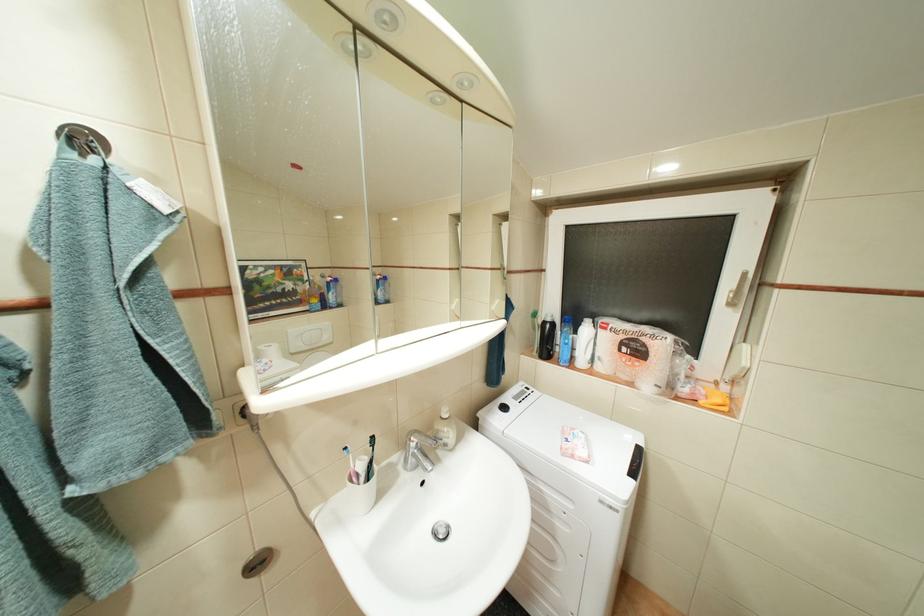
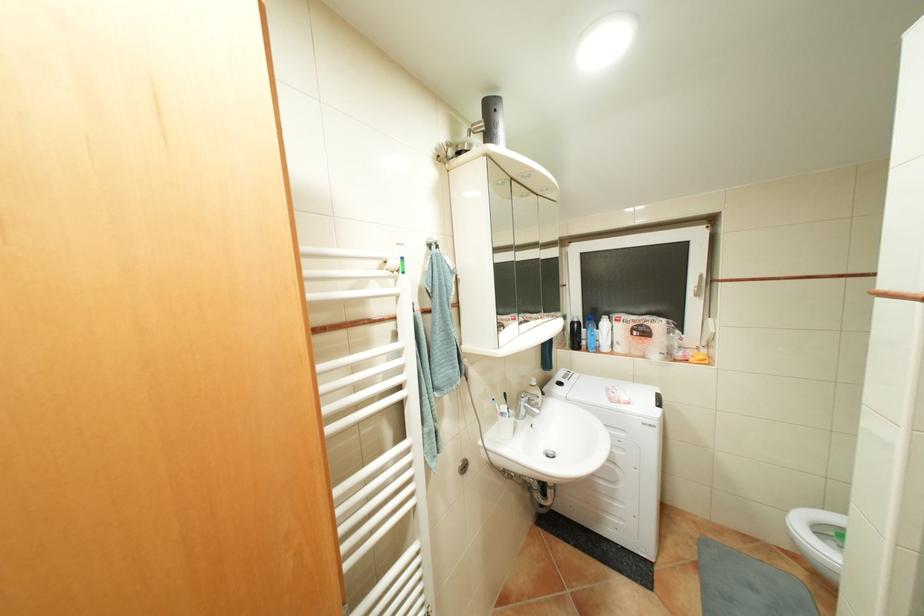
Question: The images are taken continuously from a first-person perspective. In which direction is your viewpoint rotating?

Choices:
 (A) Left
 (B) Right
 (C) Up
 (D) Down

Answer: (C)